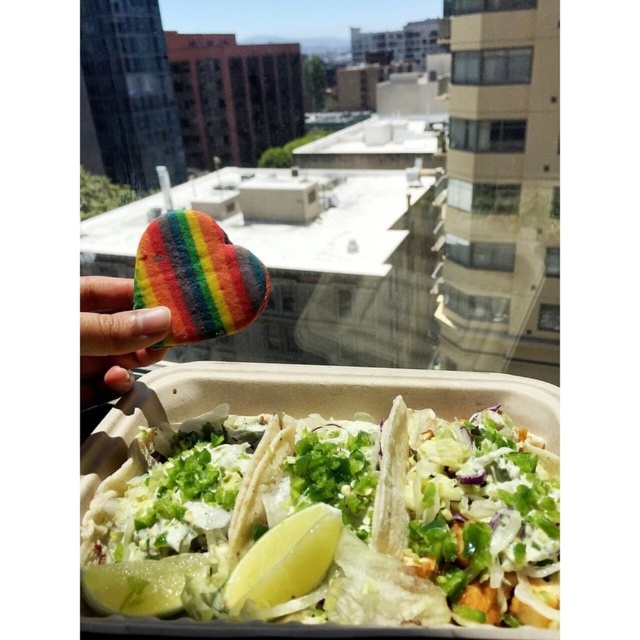
Question: Among these points, which one is nearest to the camera?

Choices:
 (A) (204, 563)
 (B) (129, 348)

Answer: (A)

Question: Estimate the real-world distances between objects in this image. Which object is farther from the green matte lemon at lower left?

Choices:
 (A) white paper taco at center
 (B) yellow matte lemon at lower center
 (C) rainbow cookie at upper left

Answer: (A)

Question: Observing the image, what is the correct spatial positioning of white paper taco at center in reference to green matte lemon at lower left?

Choices:
 (A) right
 (B) left

Answer: (A)

Question: Can you confirm if white paper taco at center is positioned above yellow matte lemon at lower center?

Choices:
 (A) no
 (B) yes

Answer: (B)

Question: Does yellow matte lemon at lower center have a smaller size compared to green matte lemon at lower left?

Choices:
 (A) no
 (B) yes

Answer: (A)

Question: Which point appears farthest from the camera in this image?

Choices:
 (A) (177, 570)
 (B) (216, 611)
 (C) (442, 512)
 (D) (109, 282)

Answer: (D)